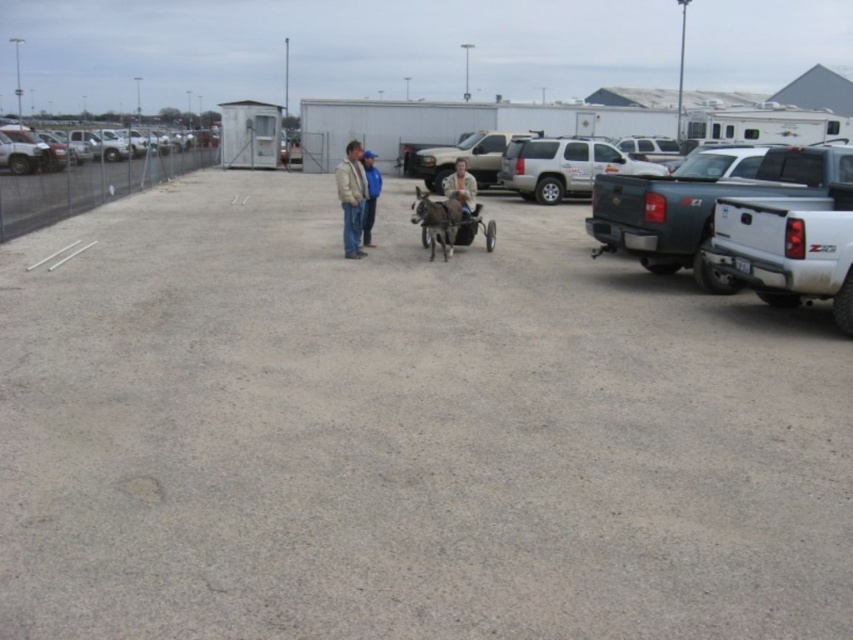
You are standing at the origin point in the parking lot. The guard booth is to your left, and the fence is along the left edge. You need to drive a matte black truck at right to the loading dock located at coordinates point 0.5, 0.5. Can you reach the loading dock without crossing the fence?

The matte black truck at right is located at point (x=699, y=208). The loading dock is at point (x=426, y=320). Since the fence is along the left edge, and the truck is on the right side of the parking lot, you can drive the matte black truck at right directly towards the loading dock at (x=426, y=320) without crossing the fence.

You are standing at the guard booth on the left and want to walk to the silver metallic suv at center. Which direction should you head?

You should head towards the center of the parking lot, as the silver metallic suv at center is located there.